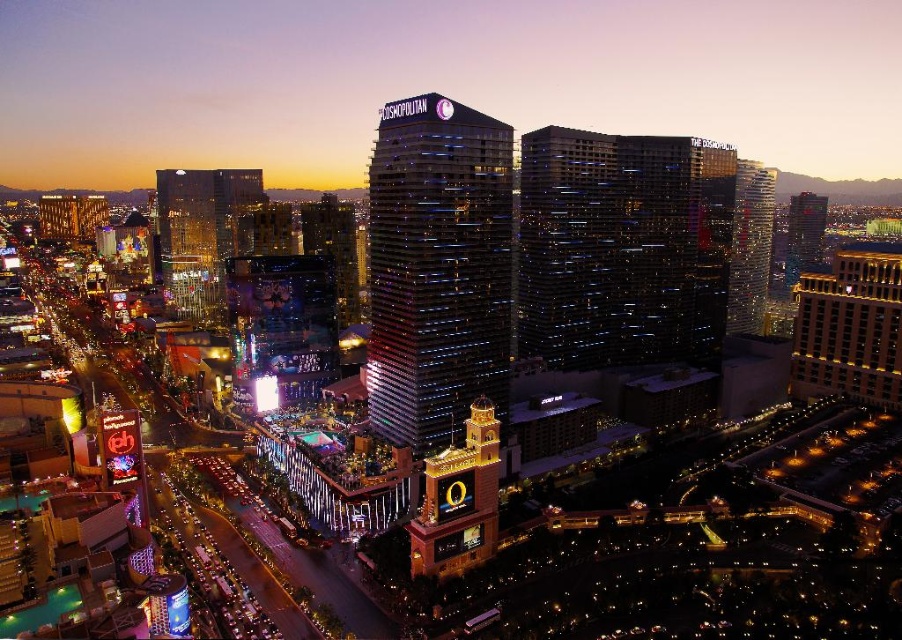
Question: Is reflective glass skyscraper at center further to the viewer compared to gold brick building at upper right?

Choices:
 (A) no
 (B) yes

Answer: (A)

Question: Which object is closer to the camera taking this photo?

Choices:
 (A) reflective glass skyscraper at center
 (B) shiny glass skyscraper at center

Answer: (B)

Question: Is gold brick building at upper right above golden brick clock tower at center?

Choices:
 (A) no
 (B) yes

Answer: (B)

Question: Estimate the real-world distances between objects in this image. Which object is closer to the shiny glass skyscraper at center?

Choices:
 (A) matte glass skyscraper at left
 (B) golden brick clock tower at center
 (C) gold brick building at upper right

Answer: (B)

Question: Which object is closer to the camera taking this photo?

Choices:
 (A) reflective glass skyscraper at center
 (B) gold brick building at upper right
 (C) golden brick clock tower at center
 (D) shiny glass skyscraper at center

Answer: (C)

Question: Is reflective glass skyscraper at center smaller than golden brick clock tower at center?

Choices:
 (A) yes
 (B) no

Answer: (B)